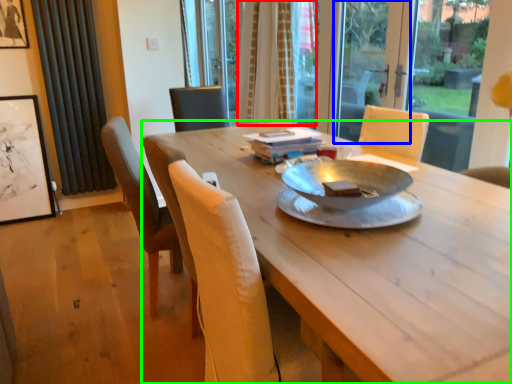
Question: Considering the real-world distances, which object is farthest from curtain (highlighted by a red box)? screen door (highlighted by a blue box) or desk (highlighted by a green box)?

Choices:
 (A) screen door
 (B) desk

Answer: (B)